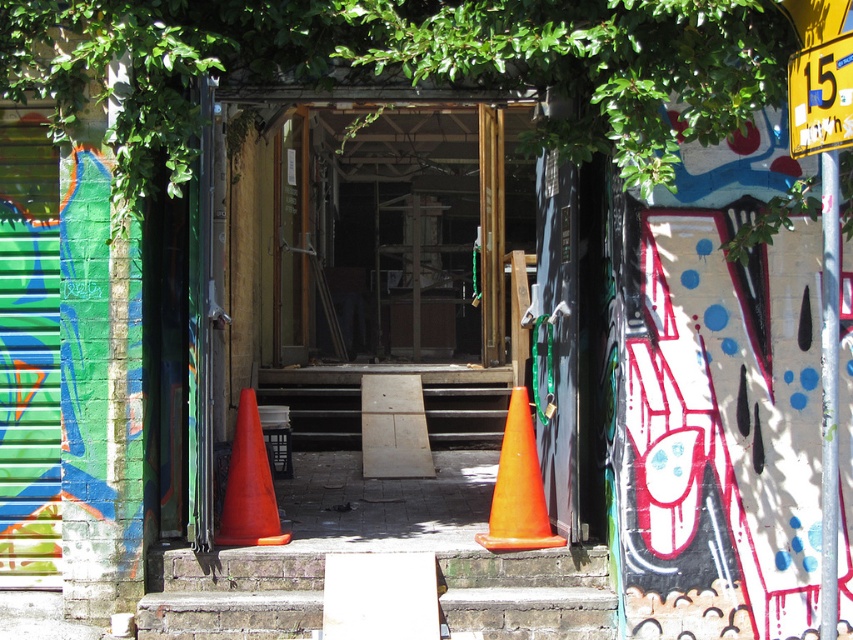
Which is below, orange plastic traffic cone at center or orange matte traffic cone at center?

Positioned lower is orange matte traffic cone at center.

This screenshot has width=853, height=640. I want to click on orange plastic traffic cone at center, so click(518, 486).

Is brick stairs at center taller than orange plastic traffic cone at center?

Incorrect, brick stairs at center's height is not larger of orange plastic traffic cone at center's.

At what (x,y) coordinates should I click in order to perform the action: click on brick stairs at center. Please return your answer as a coordinate pair (x, y). This screenshot has width=853, height=640. Looking at the image, I should click on (233, 595).

Between wooden at center and orange matte traffic cone at center, which one appears on the right side from the viewer's perspective?

From the viewer's perspective, wooden at center appears more on the right side.

Between wooden at center and orange matte traffic cone at center, which one has more height?

With more height is orange matte traffic cone at center.

Where is `wooden at center`? The height and width of the screenshot is (640, 853). wooden at center is located at coordinates (360, 403).

I want to click on wooden at center, so click(x=360, y=403).